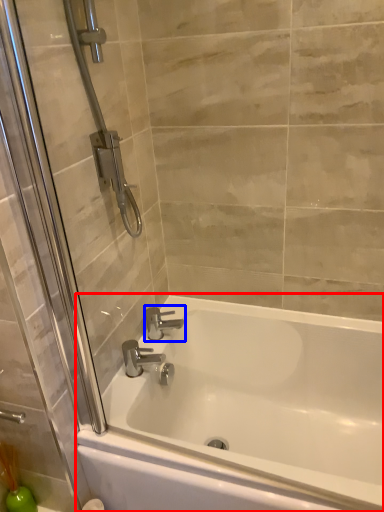
Question: Which object is further to the camera taking this photo, bathtub (highlighted by a red box) or tap (highlighted by a blue box)?

Choices:
 (A) bathtub
 (B) tap

Answer: (B)